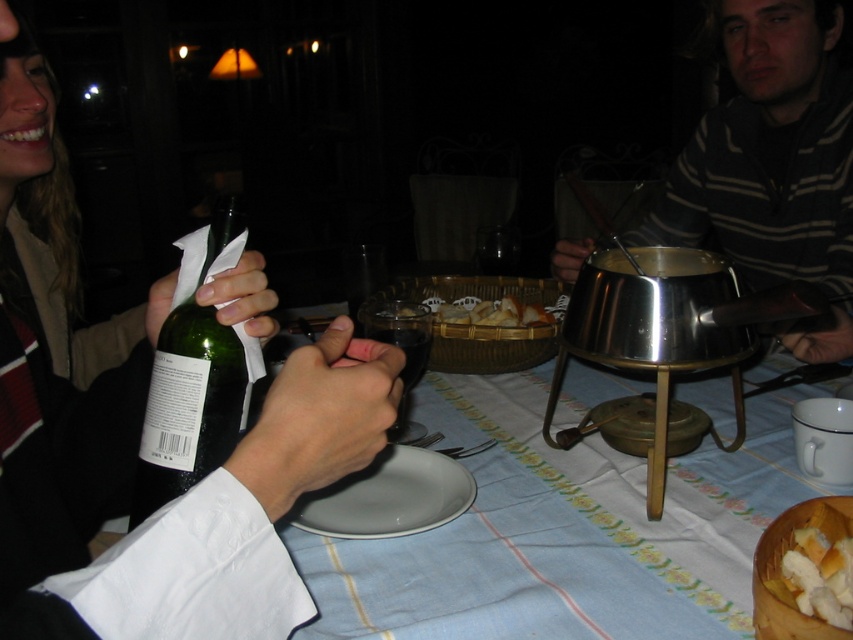
Looking at this image, what object is located at the coordinates point (387, 497)?

The white glossy plate at center is located at point (387, 497).

You are at a dinner party and need to pour wine into the white glossy plate at center. Can you pour the wine from the green glass bottle at left into it?

The green glass bottle at left is much taller than the white glossy plate at center, so pouring wine into the plate is not possible because plates are meant for holding food, not liquids.

You are at a dinner party and need to pour wine into the white glossy plate at center. Can you pour the wine from the green glass bottle at left into it without moving either object?

The green glass bottle at left is positioned on the left side of the white glossy plate at center, so pouring wine from the green glass bottle at left into the white glossy plate at center is possible as they are positioned next to each other.